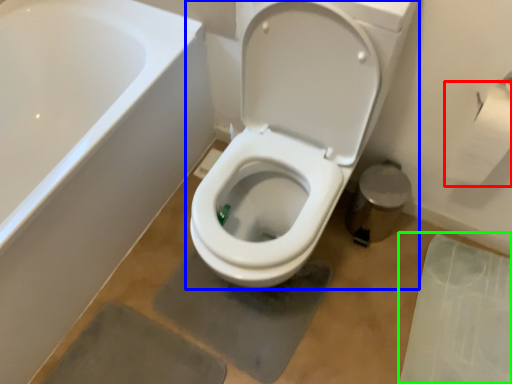
Question: Based on their relative distances, which object is nearer to toilet paper (highlighted by a red box)? Choose from toilet (highlighted by a blue box) and concrete (highlighted by a green box).

Choices:
 (A) toilet
 (B) concrete

Answer: (A)